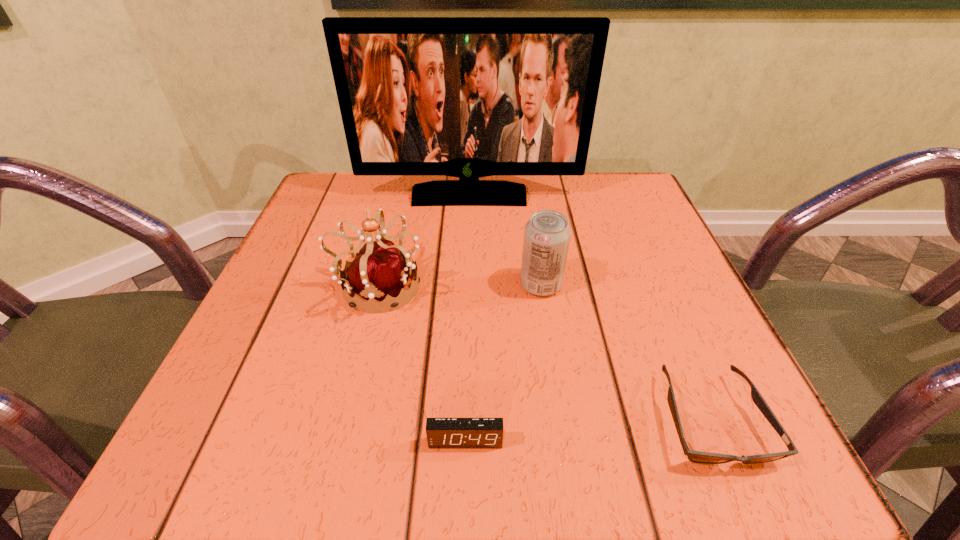
The height and width of the screenshot is (540, 960). Identify the location of free space between the second tallest object and the farthest object. (423, 241).

I want to click on blank region between the monitor and the tiara, so click(423, 241).

At what (x,y) coordinates should I click in order to perform the action: click on free space between the tiara and the rightmost object. Please return your answer as a coordinate pair (x, y). Looking at the image, I should click on tap(544, 353).

You are a GUI agent. You are given a task and a screenshot of the screen. Output one action in this format:
    pyautogui.click(x=<x>, y=<y>)
    Task: Click on the free spot between the sunglasses and the fourth tallest object
    This screenshot has width=960, height=540.
    Given the screenshot: What is the action you would take?
    pyautogui.click(x=588, y=430)

The image size is (960, 540). What are the coordinates of `empty space that is in between the alarm clock and the rightmost object` in the screenshot? It's located at tap(588, 430).

At what (x,y) coordinates should I click in order to perform the action: click on vacant space in between the tallest object and the rightmost object. Please return your answer as a coordinate pair (x, y). Image resolution: width=960 pixels, height=540 pixels. Looking at the image, I should click on [x=590, y=308].

This screenshot has height=540, width=960. In order to click on free spot between the tallest object and the tiara in this screenshot , I will do `click(423, 241)`.

The width and height of the screenshot is (960, 540). I want to click on object that is the closest to the shortest object, so click(547, 234).

Select which object is the fourth closest to the sunglasses. Please provide its 2D coordinates. Your answer should be formatted as a tuple, i.e. [(x, y)], where the tuple contains the x and y coordinates of a point satisfying the conditions above.

[(468, 97)]

Identify the location of vacant space that satisfies the following two spatial constraints: 1. on the front-facing side of the tallest object; 2. on the front-facing side of the tiara. (467, 287).